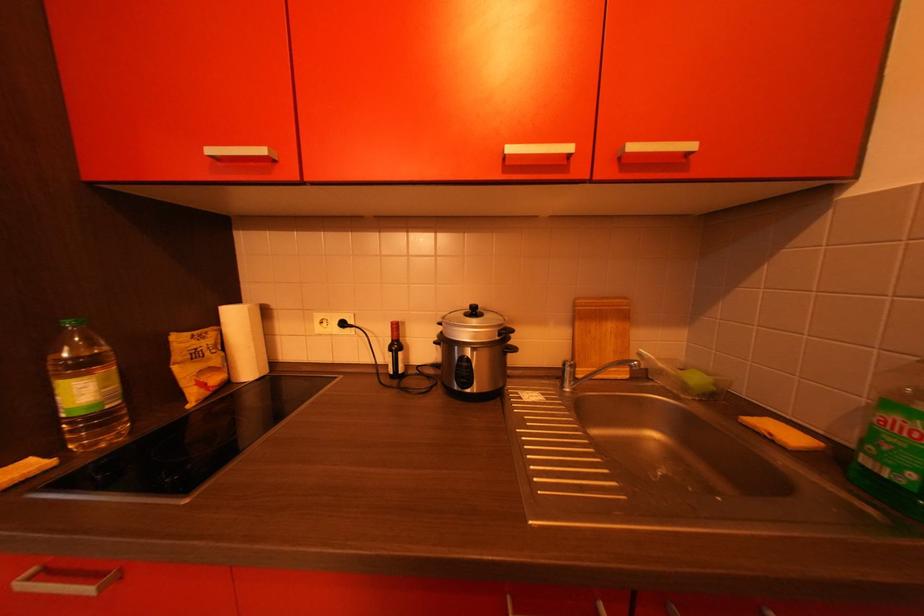
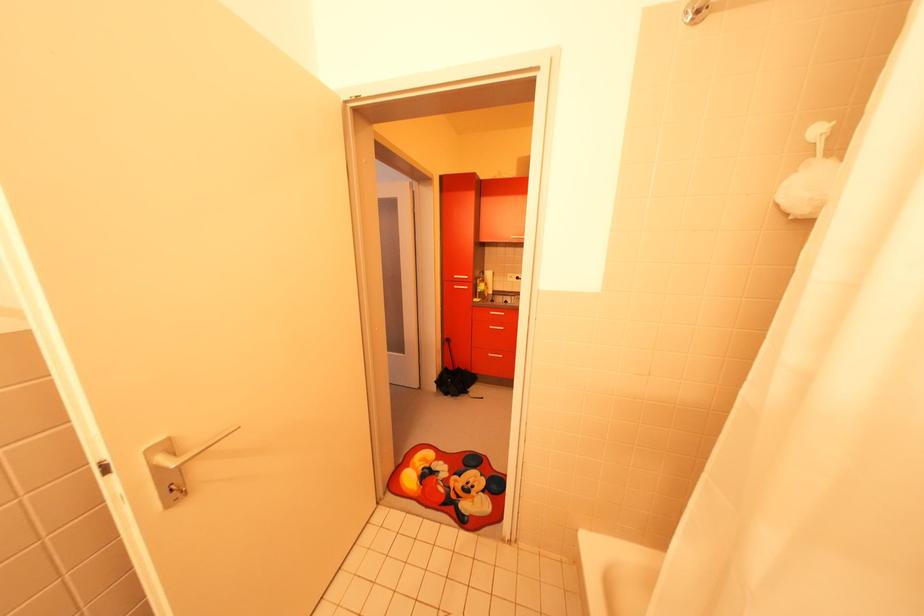
Question: Which direction would the cameraman need to move to produce the second image? Reply with the corresponding letter.

Choices:
 (A) Left
 (B) Right
 (C) Forward
 (D) Backward

Answer: (D)